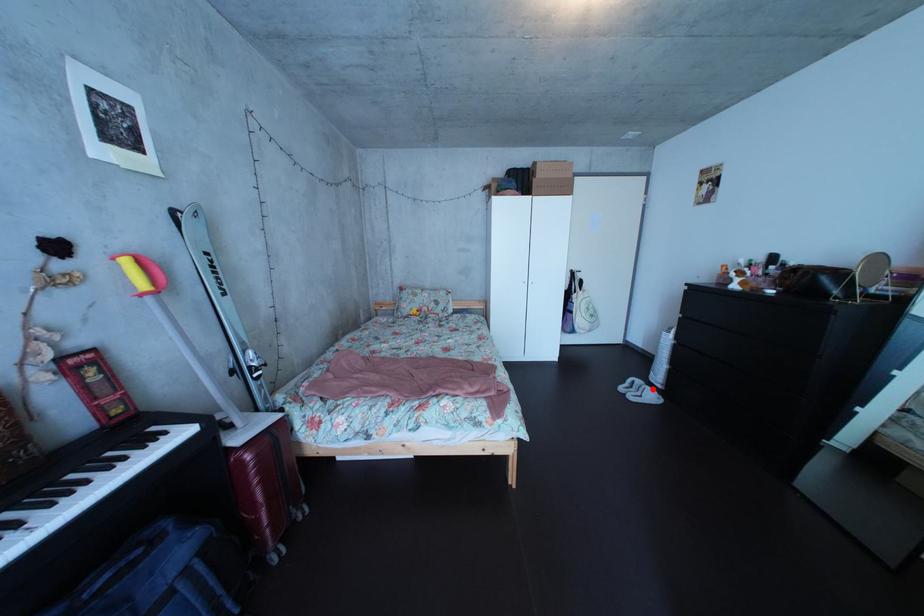
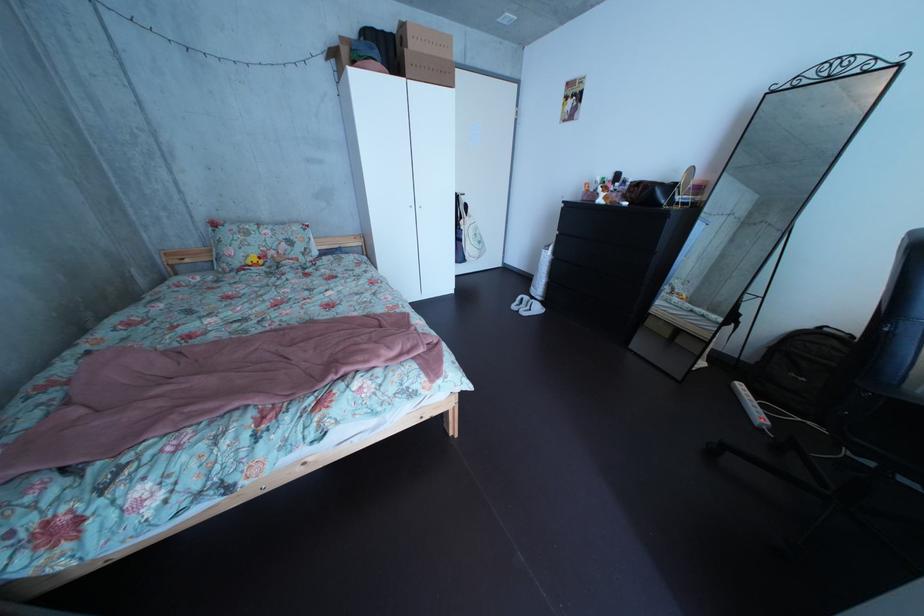
Question: I am providing you with two images of the same scene from different viewpoints. Given a red point in image1, look at the same physical point in image2. Is it:

Choices:
 (A) Closer to the viewpoint
 (B) Farther from the viewpoint

Answer: (A)